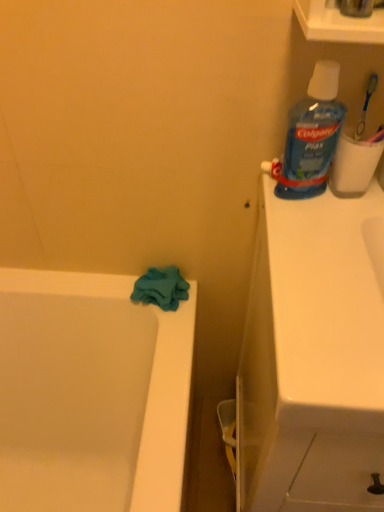
Locate an element on the screen. Image resolution: width=384 pixels, height=512 pixels. free space in front of white matte toilet paper at upper right is located at coordinates (336, 240).